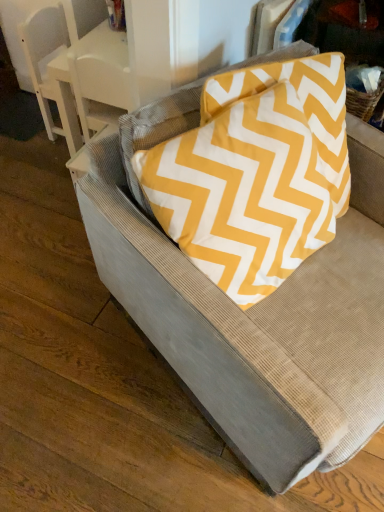
Question: Is point (152, 64) closer or farther from the camera than point (326, 443)?

Choices:
 (A) farther
 (B) closer

Answer: (A)

Question: In the image, is white glossy table at upper left on the left side or the right side of textured gray cushion at center?

Choices:
 (A) left
 (B) right

Answer: (A)

Question: Which of these objects is positioned farthest from the textured gray armchair at upper left?

Choices:
 (A) white glossy table at upper left
 (B) textured gray cushion at center
 (C) yellow zigzag fabric pillow at upper right

Answer: (B)

Question: Estimate the real-world distances between objects in this image. Which object is farther from the textured gray armchair at upper left?

Choices:
 (A) white glossy table at upper left
 (B) yellow zigzag fabric pillow at upper right
 (C) textured gray cushion at center

Answer: (C)